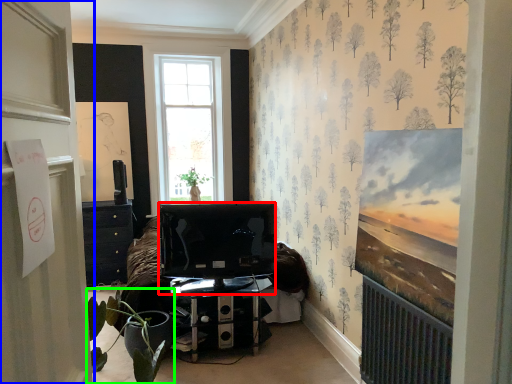
Question: Which object is positioned closest to television (highlighted by a red box)? Select from door (highlighted by a blue box) and houseplant (highlighted by a green box).

Choices:
 (A) door
 (B) houseplant

Answer: (B)